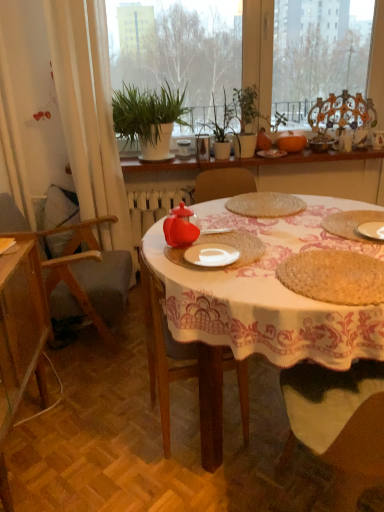
Question: From their relative heights in the image, would you say matte ceramic bowl at upper right, the 1th tableware viewed from the right, is taller or shorter than green matte plant at center?

Choices:
 (A) tall
 (B) short

Answer: (B)

Question: In terms of width, does matte ceramic bowl at upper right, the 1th tableware viewed from the right, look wider or thinner when compared to green matte plant at center?

Choices:
 (A) thin
 (B) wide

Answer: (A)

Question: Which of these objects is positioned closest to the matte white plate at center, arranged as the second tableware when viewed from the right?

Choices:
 (A) wooden shelf at center
 (B) green leafy plants at upper center
 (C) green matte plant at center
 (D) wooden cabinet at lower left
 (E) transparent glass chair at upper right, which is the third chair in left-to-right order

Answer: (C)

Question: Estimate the real-world distances between objects in this image. Which object is farther from the green leafy plants at upper center?

Choices:
 (A) white fabric curtain at left
 (B) wooden chair at left, which is the 3th chair in right-to-left order
 (C) orange matte pumpkin at center
 (D) green leafy plant at upper center
 (E) wooden chair at lower right, which appears as the second chair when viewed from the left

Answer: (E)